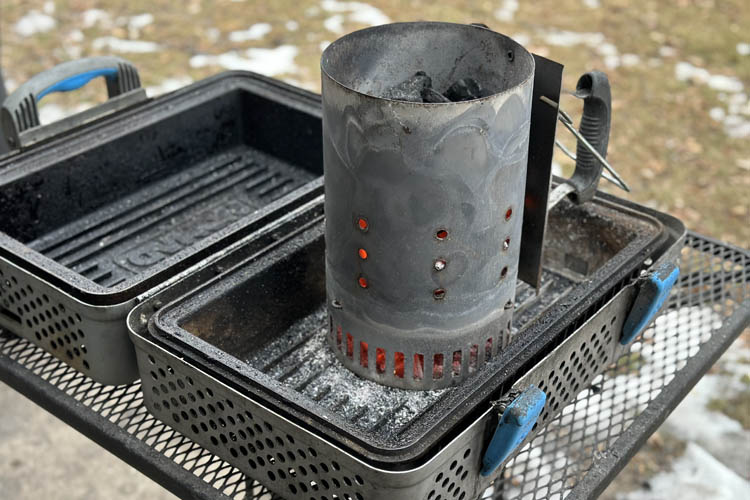
Where is `handle`? handle is located at coordinates (82, 82), (609, 125).